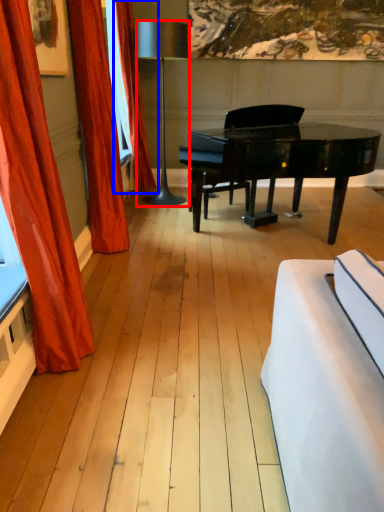
Question: Which object appears closest to the camera in this image, lamp (highlighted by a red box) or curtain (highlighted by a blue box)?

Choices:
 (A) lamp
 (B) curtain

Answer: (A)